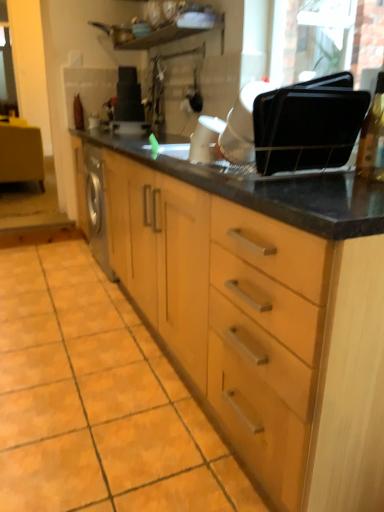
Question: Considering the positions of orange matte tile at lower left and matte wood vanity at left in the image, is orange matte tile at lower left taller or shorter than matte wood vanity at left?

Choices:
 (A) short
 (B) tall

Answer: (A)

Question: From a real-world perspective, is orange matte tile at lower left physically located above or below matte wood vanity at left?

Choices:
 (A) above
 (B) below

Answer: (B)

Question: Estimate the real-world distances between objects in this image. Which object is closer to the orange matte tile at lower left?

Choices:
 (A) black plastic trays at upper right, which is counted as the third appliance, starting from the back
 (B) black matte toaster at upper center, the 3th appliance positioned from the right
 (C) white glossy coffee maker at center, placed as the second appliance when sorted from right to left
 (D) matte wood vanity at left

Answer: (A)

Question: Which object is positioned closest to the black matte toaster at upper center, the first appliance in the left-to-right sequence?

Choices:
 (A) black plastic trays at upper right, arranged as the 1th appliance when ordered from the bottom
 (B) orange matte tile at lower left
 (C) white glossy coffee maker at center, the 2th appliance when ordered from bottom to top
 (D) matte wood vanity at left

Answer: (D)